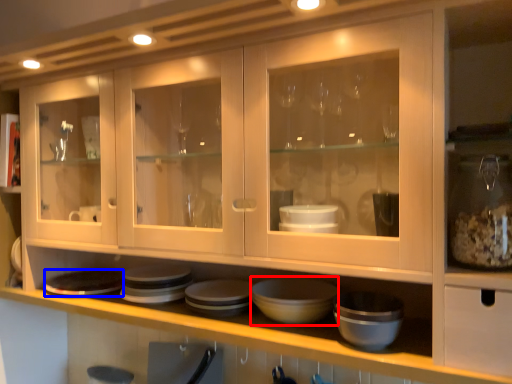
Question: Which point is further to the camera, basin (highlighted by a red box) or platter (highlighted by a blue box)?

Choices:
 (A) basin
 (B) platter

Answer: (B)